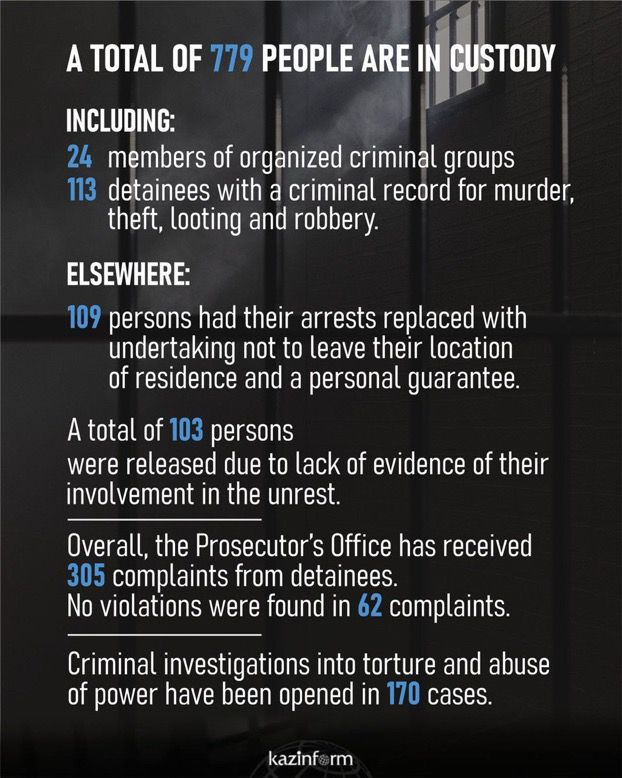
Where is `bar`? The height and width of the screenshot is (778, 622). bar is located at coordinates (420, 130).